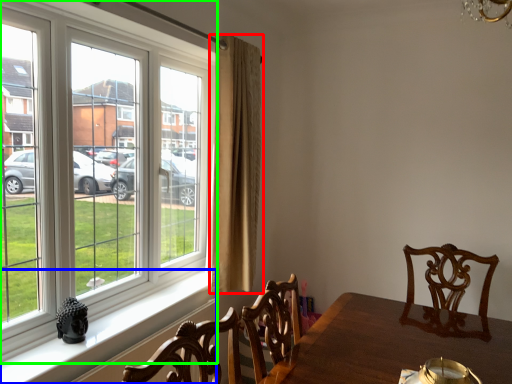
Question: Based on their relative distances, which object is farther from curtain (highlighted by a red box)? Choose from window sill (highlighted by a blue box) and window (highlighted by a green box).

Choices:
 (A) window sill
 (B) window

Answer: (A)